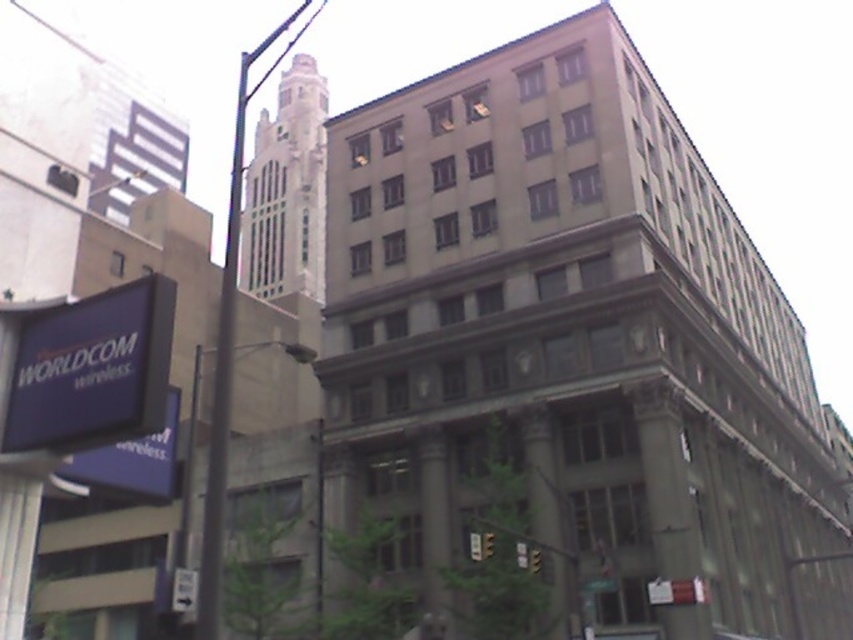
Can you confirm if blue plastic sign at lower left is positioned to the left of metallic pole at left?

Incorrect, blue plastic sign at lower left is not on the left side of metallic pole at left.

Does blue plastic sign at lower left have a larger size compared to metallic pole at left?

Actually, blue plastic sign at lower left might be smaller than metallic pole at left.

Which is behind, point (33, 422) or point (225, 442)?

Positioned behind is point (33, 422).

You are a GUI agent. You are given a task and a screenshot of the screen. Output one action in this format:
    pyautogui.click(x=<x>, y=<y>)
    Task: Click on the blue plastic sign at lower left
    Image resolution: width=853 pixels, height=640 pixels.
    Given the screenshot: What is the action you would take?
    coord(91,369)